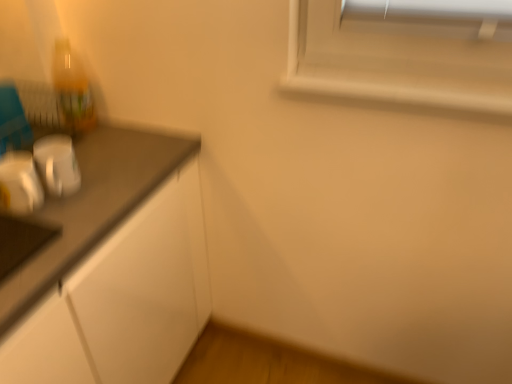
This screenshot has height=384, width=512. What do you see at coordinates (19, 183) in the screenshot?
I see `metallic silver toaster at left` at bounding box center [19, 183].

The height and width of the screenshot is (384, 512). Identify the location of metallic silver toaster at left. (19, 183).

Identify the location of translucent plastic bottle at upper left. This screenshot has height=384, width=512. (72, 89).

What do you see at coordinates (72, 89) in the screenshot? I see `translucent plastic bottle at upper left` at bounding box center [72, 89].

The height and width of the screenshot is (384, 512). I want to click on metallic silver toaster at left, so click(x=19, y=183).

Is metallic silver toaster at left at the right side of translucent plastic bottle at upper left?

Yes, metallic silver toaster at left is to the right of translucent plastic bottle at upper left.

Between metallic silver toaster at left and translucent plastic bottle at upper left, which one is positioned in front?

metallic silver toaster at left is closer to the camera.

Is point (1, 208) closer or farther from the camera than point (69, 73)?

Point (1, 208) is positioned closer to the camera compared to point (69, 73).

From the image's perspective, who appears lower, metallic silver toaster at left or translucent plastic bottle at upper left?

metallic silver toaster at left is shown below in the image.

From a real-world perspective, is metallic silver toaster at left under translucent plastic bottle at upper left?

Indeed, from a real-world perspective, metallic silver toaster at left is positioned beneath translucent plastic bottle at upper left.

Considering the sizes of objects metallic silver toaster at left and translucent plastic bottle at upper left in the image provided, who is thinner, metallic silver toaster at left or translucent plastic bottle at upper left?

translucent plastic bottle at upper left.

Considering the sizes of objects metallic silver toaster at left and translucent plastic bottle at upper left in the image provided, who is shorter, metallic silver toaster at left or translucent plastic bottle at upper left?

metallic silver toaster at left.

Who is bigger, metallic silver toaster at left or translucent plastic bottle at upper left?

Bigger between the two is translucent plastic bottle at upper left.

Is metallic silver toaster at left not within translucent plastic bottle at upper left?

Yes, metallic silver toaster at left is located beyond the bounds of translucent plastic bottle at upper left.

Is metallic silver toaster at left touching translucent plastic bottle at upper left?

No, metallic silver toaster at left is not in contact with translucent plastic bottle at upper left.

Is metallic silver toaster at left oriented away from translucent plastic bottle at upper left?

No, metallic silver toaster at left is not facing away from translucent plastic bottle at upper left.

What's the angular difference between metallic silver toaster at left and translucent plastic bottle at upper left's facing directions?

The facing directions of metallic silver toaster at left and translucent plastic bottle at upper left are 0.000176 degrees apart.

Locate an element on the screen. bottle above the metallic silver toaster at left (from a real-world perspective) is located at coordinates (72, 89).

Visually, is translucent plastic bottle at upper left positioned to the left or to the right of metallic silver toaster at left?

Clearly, translucent plastic bottle at upper left is on the left of metallic silver toaster at left in the image.

Which object is closer to the camera taking this photo, translucent plastic bottle at upper left or metallic silver toaster at left?

metallic silver toaster at left is in front.

Considering the positions of point (68, 45) and point (21, 164), is point (68, 45) closer or farther from the camera than point (21, 164)?

Clearly, point (68, 45) is more distant from the camera than point (21, 164).

From the image's perspective, which is above, translucent plastic bottle at upper left or metallic silver toaster at left?

translucent plastic bottle at upper left appears higher in the image.

From a real-world perspective, is translucent plastic bottle at upper left on metallic silver toaster at left?

Yes, from a real-world perspective, translucent plastic bottle at upper left is above metallic silver toaster at left.

Considering the relative sizes of translucent plastic bottle at upper left and metallic silver toaster at left in the image provided, is translucent plastic bottle at upper left thinner than metallic silver toaster at left?

Indeed, translucent plastic bottle at upper left has a lesser width compared to metallic silver toaster at left.

Who is shorter, translucent plastic bottle at upper left or metallic silver toaster at left?

metallic silver toaster at left.

Who is smaller, translucent plastic bottle at upper left or metallic silver toaster at left?

Smaller between the two is metallic silver toaster at left.

Is translucent plastic bottle at upper left situated inside metallic silver toaster at left or outside?

translucent plastic bottle at upper left cannot be found inside metallic silver toaster at left.

From the picture: Would you say translucent plastic bottle at upper left is a long distance from metallic silver toaster at left?

They are positioned close to each other.

From the picture: Is translucent plastic bottle at upper left looking in the opposite direction of metallic silver toaster at left?

That's not correct — translucent plastic bottle at upper left is not looking away from metallic silver toaster at left.

Where is `bottle to the left of metallic silver toaster at left`? bottle to the left of metallic silver toaster at left is located at coordinates (72, 89).

This screenshot has height=384, width=512. What are the coordinates of `bottle on the left of metallic silver toaster at left` in the screenshot? It's located at (72, 89).

Locate an element on the screen. This screenshot has height=384, width=512. bottle that is above the metallic silver toaster at left (from the image's perspective) is located at coordinates (72, 89).